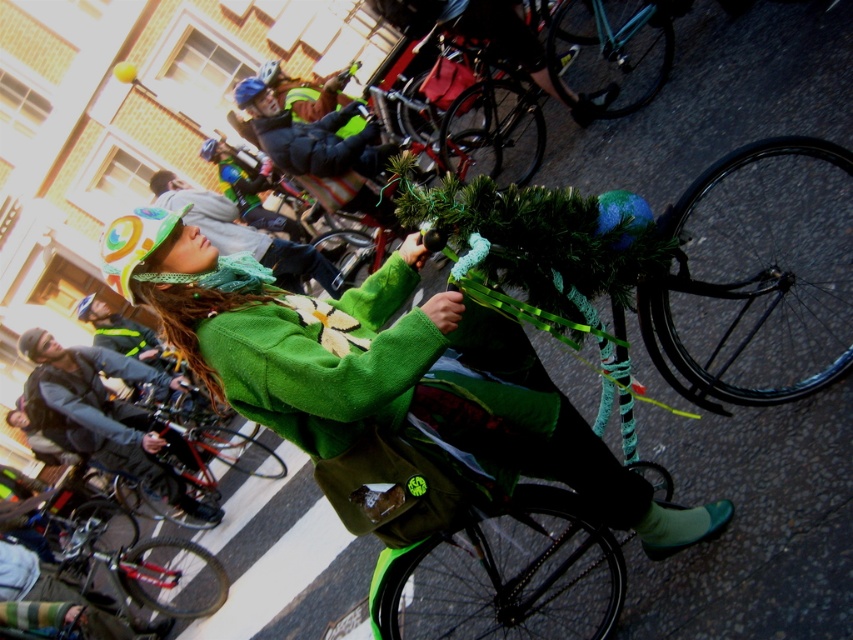
Which of these two, green knitted hat at upper left or green fuzzy hat at center, stands shorter?

green fuzzy hat at center

Can you confirm if green knitted hat at upper left is positioned to the right of green fuzzy hat at center?

Correct, you'll find green knitted hat at upper left to the right of green fuzzy hat at center.

In order to click on green knitted hat at upper left in this screenshot , I will do `click(384, 387)`.

Who is higher up, green knitted hat at upper left or green woolen coat at center?

green knitted hat at upper left is higher up.

You are a GUI agent. You are given a task and a screenshot of the screen. Output one action in this format:
    pyautogui.click(x=<x>, y=<y>)
    Task: Click on the green knitted hat at upper left
    Image resolution: width=853 pixels, height=640 pixels.
    Given the screenshot: What is the action you would take?
    pyautogui.click(x=384, y=387)

Identify the location of green knitted hat at upper left. (384, 387).

Is green woolen coat at center smaller than green fuzzy hat at center?

Actually, green woolen coat at center might be larger than green fuzzy hat at center.

Which is above, green woolen coat at center or green fuzzy hat at center?

green fuzzy hat at center is higher up.

Between point (45, 358) and point (293, 269), which one is positioned in front?

Point (45, 358) is more forward.

The width and height of the screenshot is (853, 640). What are the coordinates of `green woolen coat at center` in the screenshot? It's located at (103, 413).